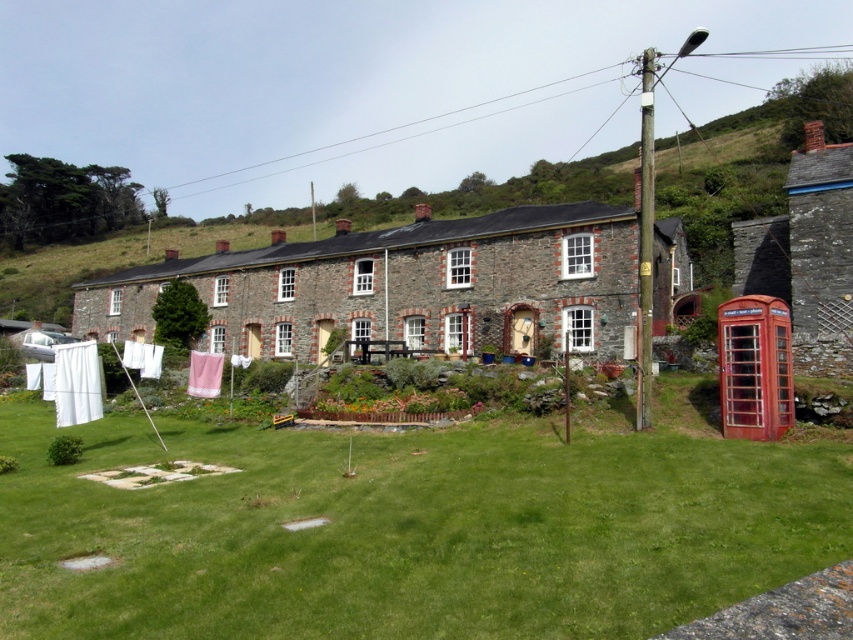
Can you confirm if green grass at lower center is positioned to the right of rustic stone cottage at center?

Incorrect, green grass at lower center is not on the right side of rustic stone cottage at center.

The width and height of the screenshot is (853, 640). Describe the element at coordinates (407, 531) in the screenshot. I see `green grass at lower center` at that location.

Measure the distance between point (630, 486) and camera.

Point (630, 486) is 16.80 meters from camera.

Locate an element on the screen. green grass at lower center is located at coordinates click(x=407, y=531).